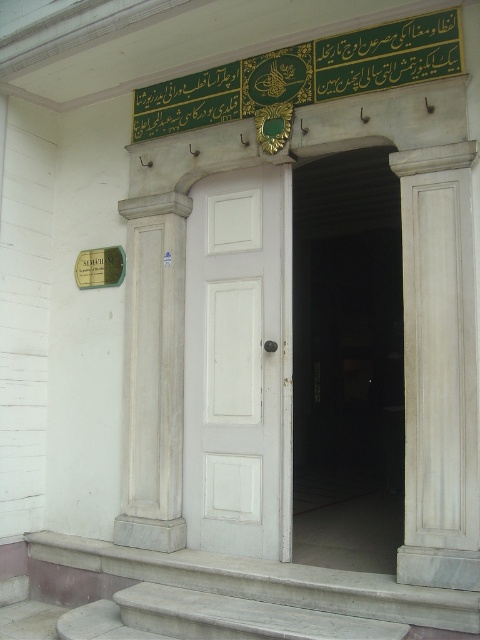
Question: Where is white painted wood door at center located in relation to white marble column at left in the image?

Choices:
 (A) right
 (B) left

Answer: (A)

Question: Among these objects, which one is farthest from the camera?

Choices:
 (A) white painted wood door at center
 (B) white wooden door at center
 (C) gray marble stairs at lower left
 (D) green metallic plaque at left

Answer: (B)

Question: Among these objects, which one is farthest from the camera?

Choices:
 (A) green metallic plaque at left
 (B) white marble column at right
 (C) white marble column at left
 (D) concrete steps at lower center

Answer: (A)

Question: Which object is the closest to the gray marble stairs at lower left?

Choices:
 (A) white marble column at right
 (B) white wooden door at center

Answer: (A)

Question: Can you confirm if white painted wood door at center is wider than concrete steps at lower center?

Choices:
 (A) yes
 (B) no

Answer: (B)

Question: Does white wooden door at center lie in front of white marble column at right?

Choices:
 (A) no
 (B) yes

Answer: (A)